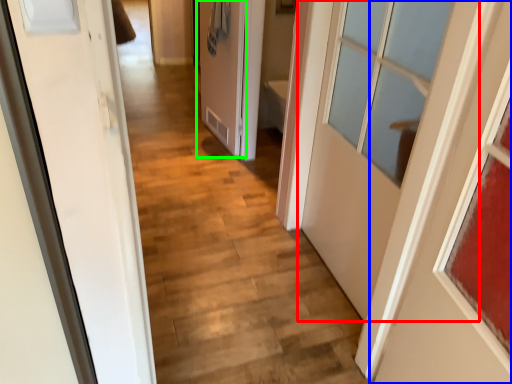
Question: Which object is positioned farthest from door (highlighted by a red box)? Select from door (highlighted by a blue box) and door (highlighted by a green box).

Choices:
 (A) door
 (B) door

Answer: (B)